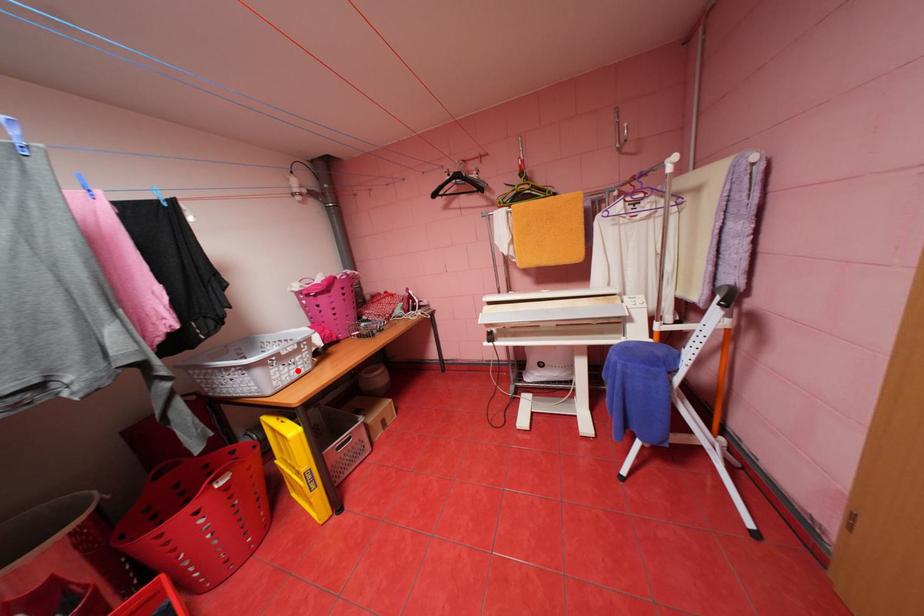
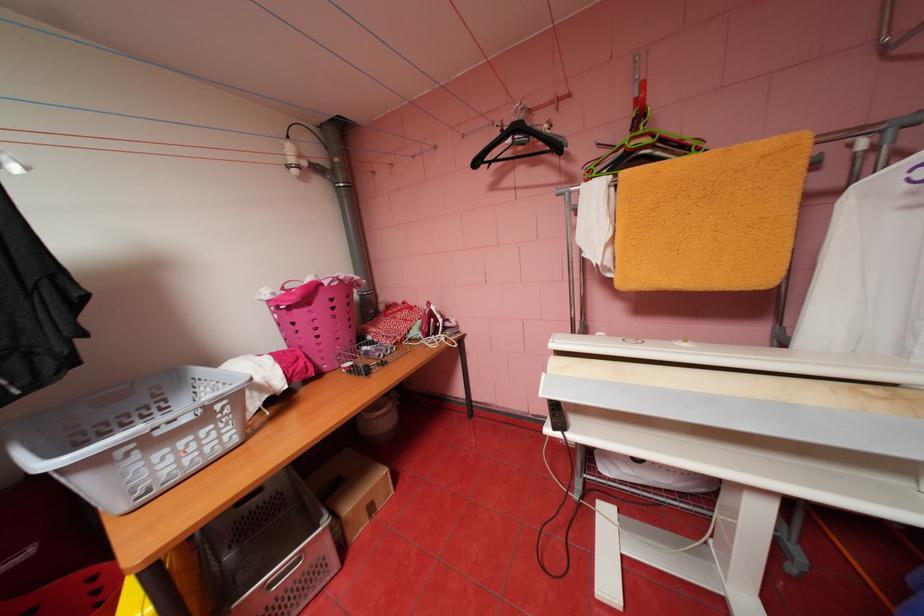
In the second image, find the point that corresponds to the highlighted location in the first image.

(187, 460)